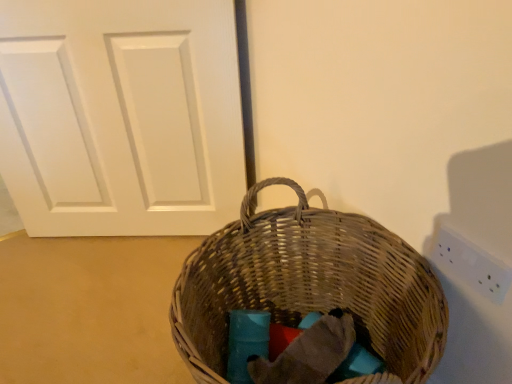
Question: Should I look upward or downward to see white matte door at center?

Choices:
 (A) up
 (B) down

Answer: (A)

Question: Does woven brown picnic basket at center have a lesser height compared to white plastic electric outlet at upper right?

Choices:
 (A) no
 (B) yes

Answer: (A)

Question: From a real-world perspective, does woven brown picnic basket at center sit lower than white plastic electric outlet at upper right?

Choices:
 (A) yes
 (B) no

Answer: (A)

Question: From the image's perspective, is woven brown picnic basket at center located beneath white plastic electric outlet at upper right?

Choices:
 (A) yes
 (B) no

Answer: (A)

Question: Is woven brown picnic basket at center further to the viewer compared to white plastic electric outlet at upper right?

Choices:
 (A) yes
 (B) no

Answer: (B)

Question: Is woven brown picnic basket at center at the left side of white plastic electric outlet at upper right?

Choices:
 (A) no
 (B) yes

Answer: (B)

Question: Is woven brown picnic basket at center oriented away from white plastic electric outlet at upper right?

Choices:
 (A) no
 (B) yes

Answer: (B)

Question: Is white plastic electric outlet at upper right at the right side of white matte door at center?

Choices:
 (A) no
 (B) yes

Answer: (B)

Question: Does white plastic electric outlet at upper right turn towards white matte door at center?

Choices:
 (A) yes
 (B) no

Answer: (B)

Question: Can you confirm if white plastic electric outlet at upper right is wider than white matte door at center?

Choices:
 (A) no
 (B) yes

Answer: (A)

Question: Does white plastic electric outlet at upper right come behind white matte door at center?

Choices:
 (A) yes
 (B) no

Answer: (B)

Question: Does white plastic electric outlet at upper right have a greater height compared to white matte door at center?

Choices:
 (A) yes
 (B) no

Answer: (B)

Question: From the image's perspective, is white plastic electric outlet at upper right on top of white matte door at center?

Choices:
 (A) yes
 (B) no

Answer: (B)

Question: Are white matte door at center and white plastic electric outlet at upper right far apart?

Choices:
 (A) yes
 (B) no

Answer: (B)